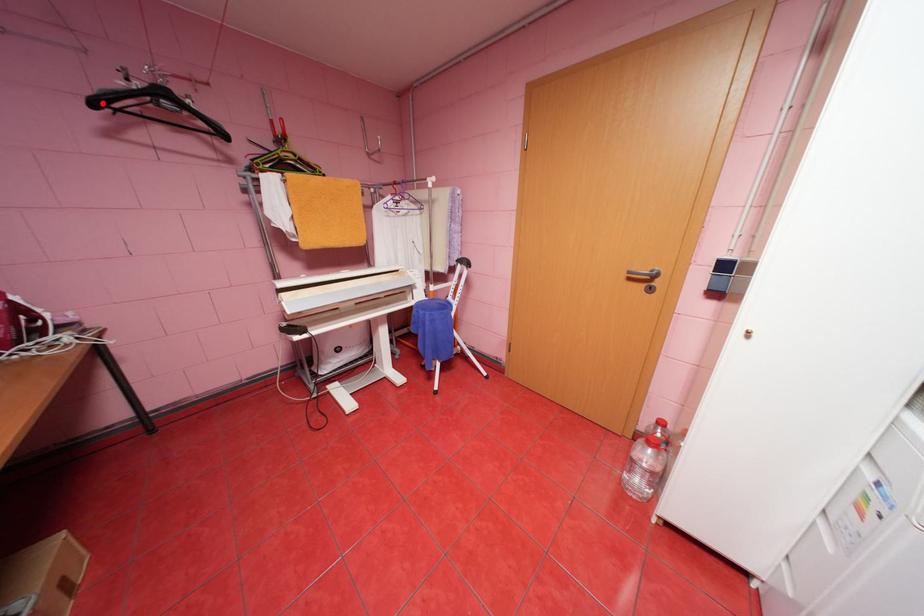
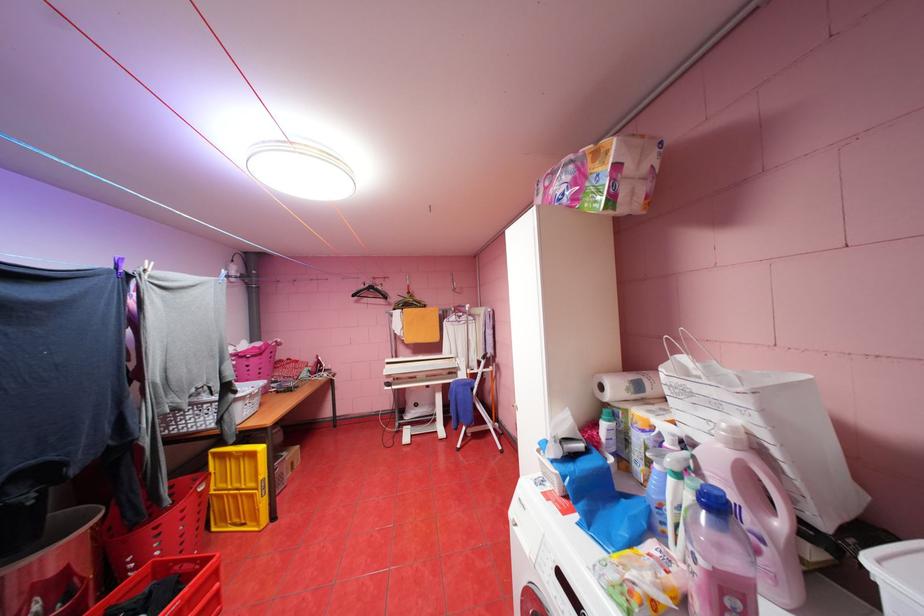
Question: I am providing you with two images of the same scene from different viewpoints. A red point is marked on the first image. Is the red point's position out of view in image 2?

Choices:
 (A) Yes
 (B) No

Answer: (B)